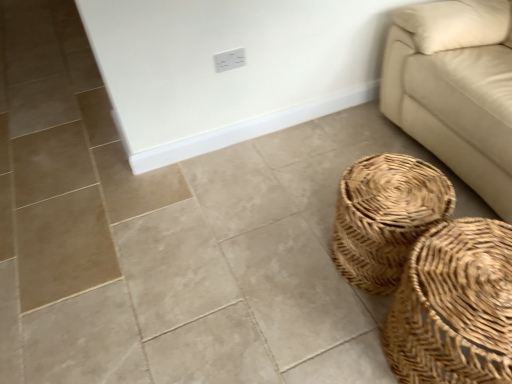
Locate an element on the screen. The height and width of the screenshot is (384, 512). free location to the left of woven natural basket at lower right, the second basket viewed from the front is located at coordinates (291, 269).